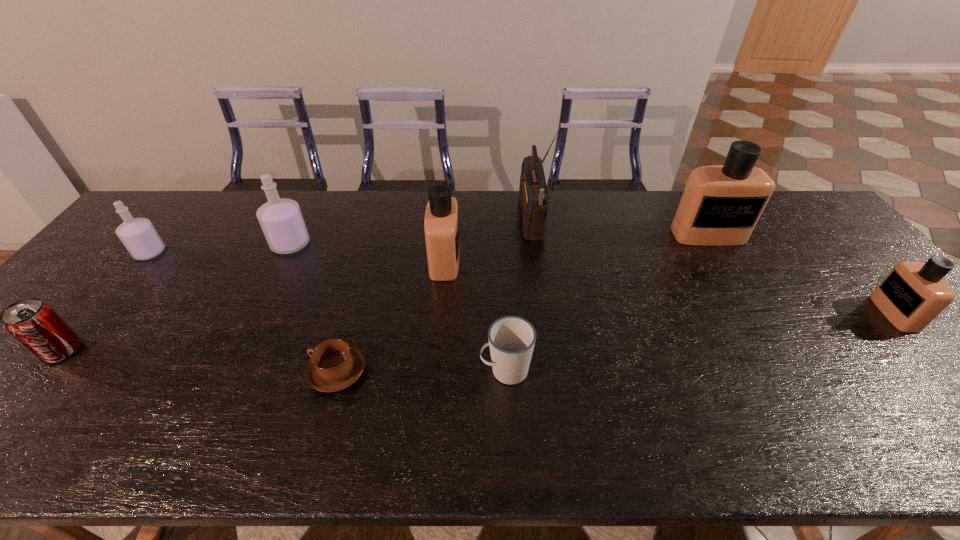
Locate an element on the screen. The image size is (960, 540). the tallest object is located at coordinates (534, 199).

Where is `radio receiver`? radio receiver is located at coordinates (534, 199).

Locate an element on the screen. the second beige perfume from left to right is located at coordinates (721, 204).

Image resolution: width=960 pixels, height=540 pixels. I want to click on the tallest perfume, so click(x=721, y=204).

Identify the location of the third object from left to right. This screenshot has height=540, width=960. (281, 220).

The height and width of the screenshot is (540, 960). What are the coordinates of `the bigger purple perfume` in the screenshot? It's located at (281, 220).

At what (x,y) coordinates should I click in order to perform the action: click on the leftmost beige perfume. Please return your answer as a coordinate pair (x, y). This screenshot has height=540, width=960. Looking at the image, I should click on (441, 224).

Find the location of a particular element. the fifth object from right to left is located at coordinates (441, 224).

Locate an element on the screen. The image size is (960, 540). the rightmost object is located at coordinates (913, 294).

Identify the location of the nearest beige perfume. The image size is (960, 540). (913, 294).